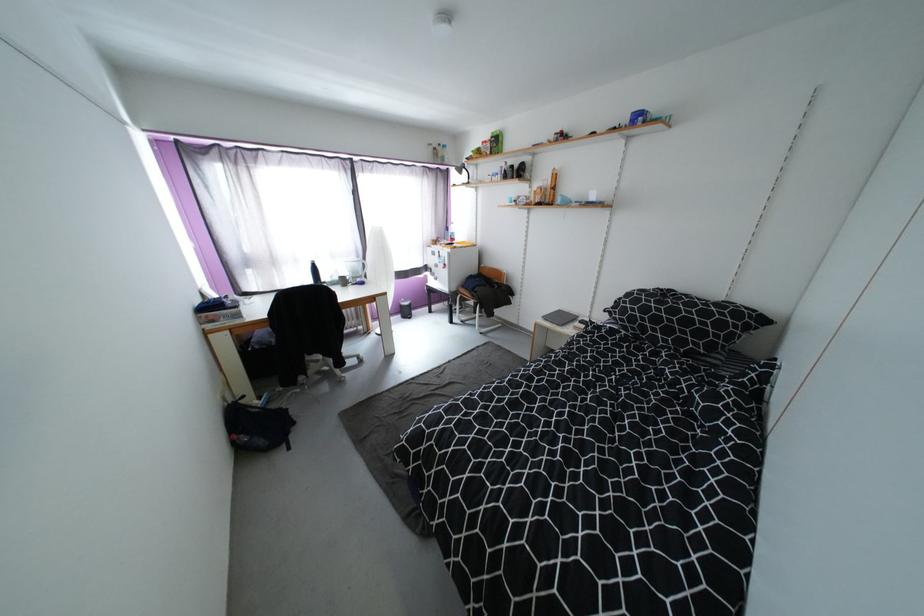
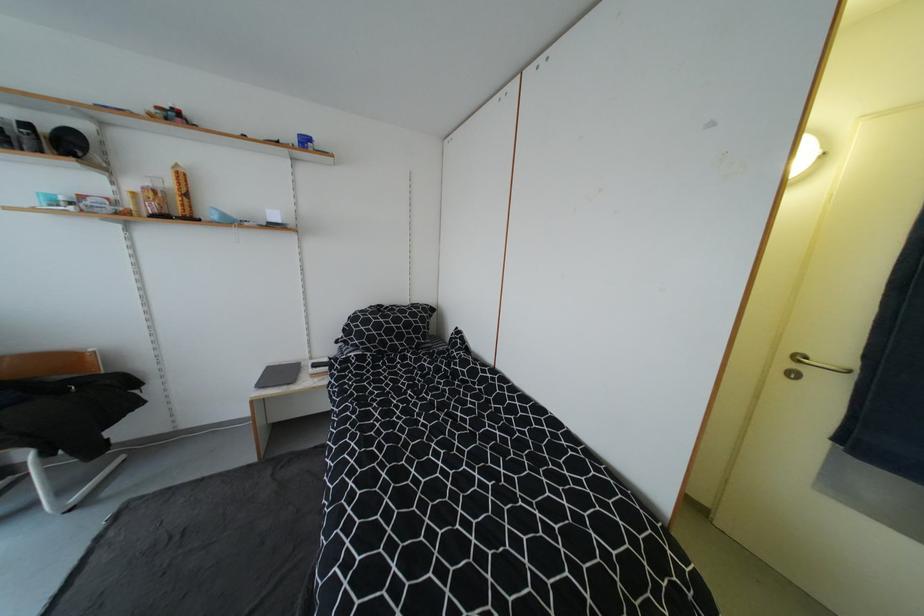
Locate, in the second image, the point that corresponds to (x=630, y=304) in the first image.

(362, 328)